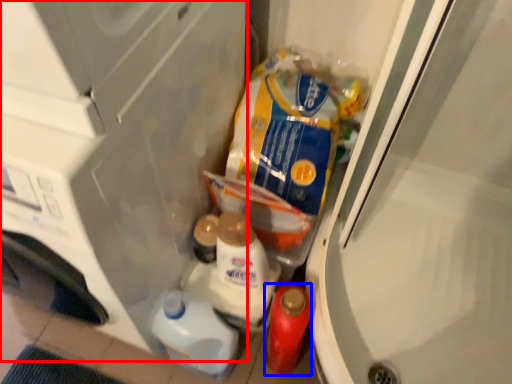
Question: Among these objects, which one is nearest to the camera, appliance (highlighted by a red box) or bottle (highlighted by a blue box)?

Choices:
 (A) appliance
 (B) bottle

Answer: (A)